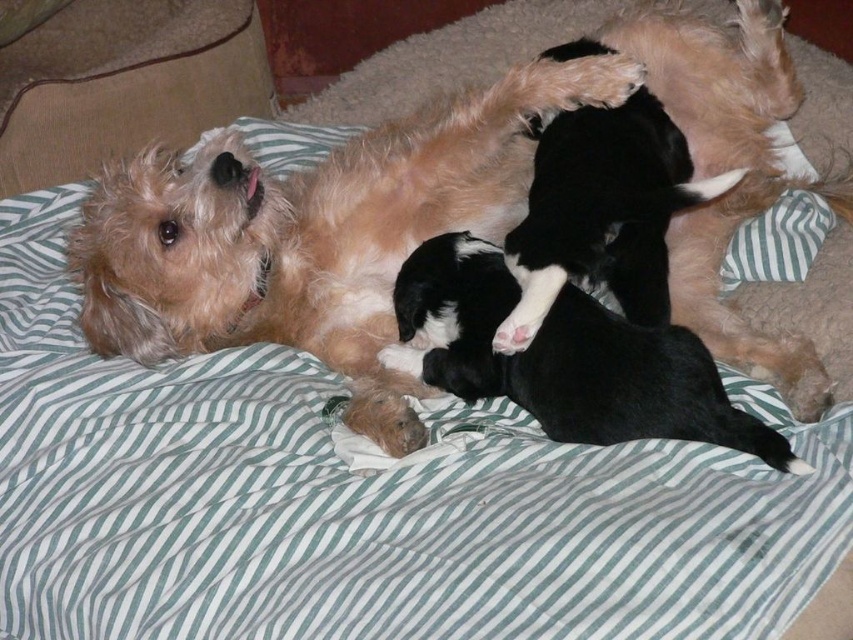
Is fuzzy brown dog at upper left positioned in front of black soft fur at center?

No, it is not.

Who is taller, fuzzy brown dog at upper left or black soft fur at center?

With more height is fuzzy brown dog at upper left.

Locate an element on the screen. This screenshot has width=853, height=640. fuzzy brown dog at upper left is located at coordinates (312, 234).

Does point (325, 346) lie behind point (741, 221)?

No.

Is the position of fuzzy brown dog at upper left less distant than that of green striped pillow at center?

Yes, it is in front of green striped pillow at center.

Where is `fuzzy brown dog at upper left`? The width and height of the screenshot is (853, 640). fuzzy brown dog at upper left is located at coordinates (312, 234).

Is point (433, 305) positioned before point (782, 243)?

Yes, it is.

Where is `black smooth fur puppies at center`? black smooth fur puppies at center is located at coordinates (563, 358).

Is point (463, 244) closer to camera compared to point (734, 278)?

That is True.

You are a GUI agent. You are given a task and a screenshot of the screen. Output one action in this format:
    pyautogui.click(x=<x>, y=<y>)
    Task: Click on the black smooth fur puppies at center
    
    Given the screenshot: What is the action you would take?
    pyautogui.click(x=563, y=358)